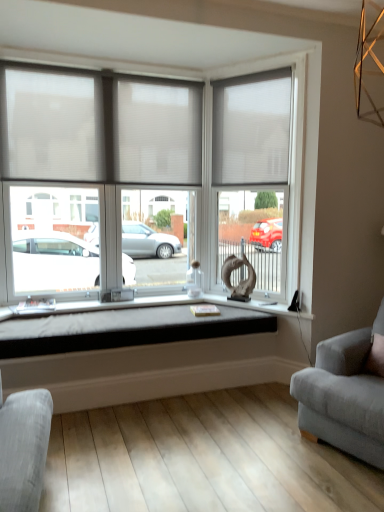
Question: Considering the relative sizes of black fabric cushion at center and white fabric window blind at upper right, which is the 1th window blind in right-to-left order, in the image provided, is black fabric cushion at center taller than white fabric window blind at upper right, which is the 1th window blind in right-to-left order,?

Choices:
 (A) no
 (B) yes

Answer: (A)

Question: Is black fabric cushion at center positioned with its back to white fabric window blind at upper right, the 2th window blind when ordered from left to right?

Choices:
 (A) yes
 (B) no

Answer: (B)

Question: Can you confirm if black fabric cushion at center is bigger than white fabric window blind at upper right, which is the 1th window blind in right-to-left order?

Choices:
 (A) no
 (B) yes

Answer: (B)

Question: Is white fabric window blind at upper right, the 2th window blind when ordered from left to right, completely or partially inside black fabric cushion at center?

Choices:
 (A) no
 (B) yes

Answer: (A)

Question: Is black fabric cushion at center in contact with white fabric window blind at upper right, the 2th window blind when ordered from left to right?

Choices:
 (A) no
 (B) yes

Answer: (A)

Question: Can you confirm if black fabric cushion at center is smaller than white fabric window blind at upper right, which is the 1th window blind in right-to-left order?

Choices:
 (A) yes
 (B) no

Answer: (B)

Question: Considering the relative sizes of matte glass door at center and white fabric window blind at upper right, which is the 1th window blind in right-to-left order, in the image provided, is matte glass door at center bigger than white fabric window blind at upper right, which is the 1th window blind in right-to-left order,?

Choices:
 (A) yes
 (B) no

Answer: (A)

Question: Can you confirm if matte glass door at center is positioned to the left of white fabric window blind at upper right, which is the 1th window blind in right-to-left order?

Choices:
 (A) yes
 (B) no

Answer: (B)

Question: Is the surface of matte glass door at center in direct contact with white fabric window blind at upper right, which is the 1th window blind in right-to-left order?

Choices:
 (A) no
 (B) yes

Answer: (B)

Question: Considering the relative sizes of matte glass door at center and white fabric window blind at upper right, the 2th window blind when ordered from left to right, in the image provided, is matte glass door at center taller than white fabric window blind at upper right, the 2th window blind when ordered from left to right,?

Choices:
 (A) no
 (B) yes

Answer: (B)

Question: Considering the relative positions of matte glass door at center and white fabric window blind at upper right, the 2th window blind when ordered from left to right, in the image provided, is matte glass door at center behind white fabric window blind at upper right, the 2th window blind when ordered from left to right,?

Choices:
 (A) yes
 (B) no

Answer: (B)

Question: From the image's perspective, is matte glass door at center above white fabric window blind at upper right, which is the 1th window blind in right-to-left order?

Choices:
 (A) yes
 (B) no

Answer: (B)

Question: Could you tell me if white sheer blinds at upper left, the 1th window blind from the left, is facing white fabric window blind at upper right, which is the 1th window blind in right-to-left order?

Choices:
 (A) no
 (B) yes

Answer: (A)